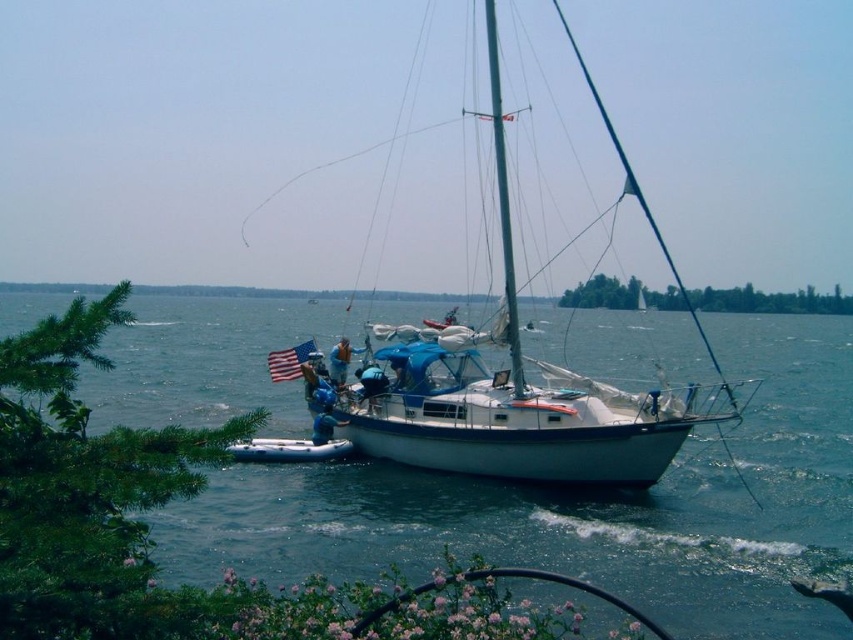
You are a sailor on the sailboat and need to quickly identify which object is taller between the american flag fabric at center and the blue fabric life vest at center. Based on the scene, which one is taller?

The american flag fabric at center is much taller than the blue fabric life vest at center.

You are an observer standing on the dock and looking at the white glossy sailboat at center and the american flag fabric at center. Which object appears taller from your viewpoint?

The white glossy sailboat at center appears taller than the american flag fabric at center because it has a greater height compared to the american flag fabric at center.

You are standing at the edge of the water and see two points on the sailboat. The first point is at coordinates point (544, 397) and the second point is at point (369, 397). Which point is closer to you?

Point (544, 397) is closer to the viewer than point (369, 397).